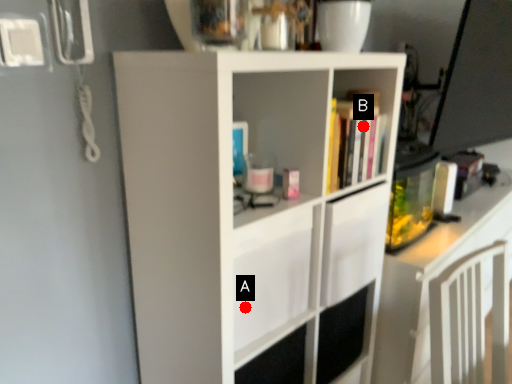
Question: Two points are circled on the image, labeled by A and B beside each circle. Which of the following is the closest to the observer?

Choices:
 (A) A is closer
 (B) B is closer

Answer: (A)